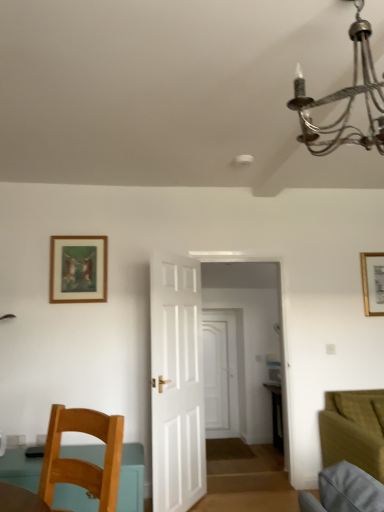
Question: Would you say velvet olive green couch at lower right is inside or outside wooden framed artwork at upper left, which ranks as the first picture frame in front-to-back order?

Choices:
 (A) outside
 (B) inside

Answer: (A)

Question: Looking at their shapes, would you say velvet olive green couch at lower right is wider or thinner than wooden framed artwork at upper left, which ranks as the second picture frame in right-to-left order?

Choices:
 (A) thin
 (B) wide

Answer: (B)

Question: Which object is positioned closest to the wooden framed artwork at upper left, which ranks as the second picture frame in right-to-left order?

Choices:
 (A) silver wire chandelier at upper right
 (B) teal matte table at lower left
 (C) white matte door at center, placed as the 1th door when sorted from right to left
 (D) velvet olive green couch at lower right
 (E) white wooden door at center, the 2th door from the back

Answer: (E)

Question: Which of these objects is positioned farthest from the velvet olive green couch at lower right?

Choices:
 (A) white matte door at center, placed as the 1th door when sorted from right to left
 (B) teal matte table at lower left
 (C) silver wire chandelier at upper right
 (D) wooden framed artwork at upper left, which ranks as the second picture frame in right-to-left order
 (E) wooden chair at lower left

Answer: (A)